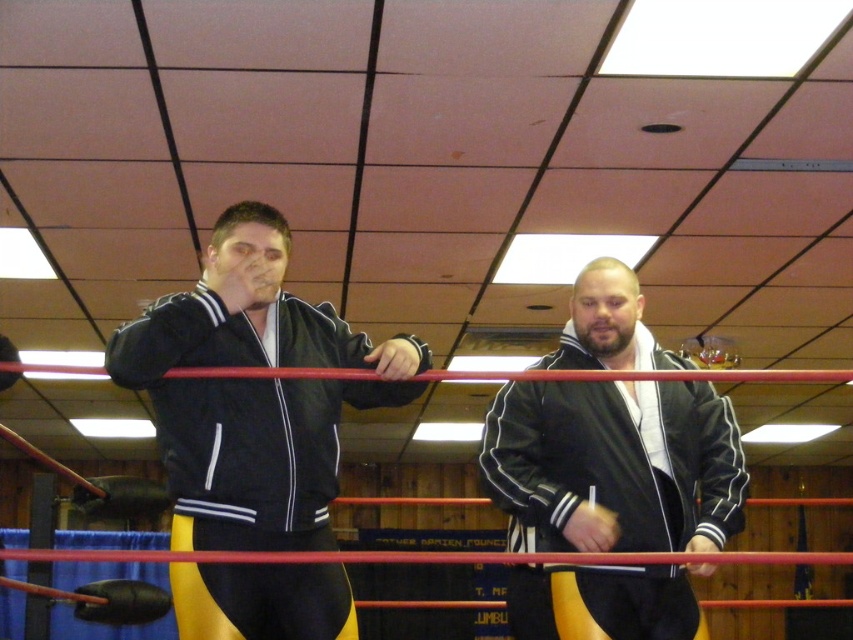
Describe the element at coordinates (614, 465) in the screenshot. I see `black leather jacket at center` at that location.

Does point (518, 572) lie behind point (13, 344)?

No, (518, 572) is closer to viewer.

Which is behind, point (635, 408) or point (16, 378)?

Positioned behind is point (635, 408).

You are a GUI agent. You are given a task and a screenshot of the screen. Output one action in this format:
    pyautogui.click(x=<x>, y=<y>)
    Task: Click on the black leather jacket at center
    
    Given the screenshot: What is the action you would take?
    pyautogui.click(x=614, y=465)

Which is above, matte black jacket at center or black leather boxing glove at left?

Positioned higher is black leather boxing glove at left.

Is matte black jacket at center bigger than black leather boxing glove at left?

Correct, matte black jacket at center is larger in size than black leather boxing glove at left.

Between point (115, 337) and point (7, 339), which one is positioned behind?

Point (7, 339)

Image resolution: width=853 pixels, height=640 pixels. In order to click on matte black jacket at center in this screenshot , I will do `click(253, 392)`.

Image resolution: width=853 pixels, height=640 pixels. What do you see at coordinates (253, 392) in the screenshot? I see `matte black jacket at center` at bounding box center [253, 392].

Is matte black jacket at center positioned at the back of black leather jacket at center?

No, matte black jacket at center is closer to the viewer.

Identify the location of matte black jacket at center. (253, 392).